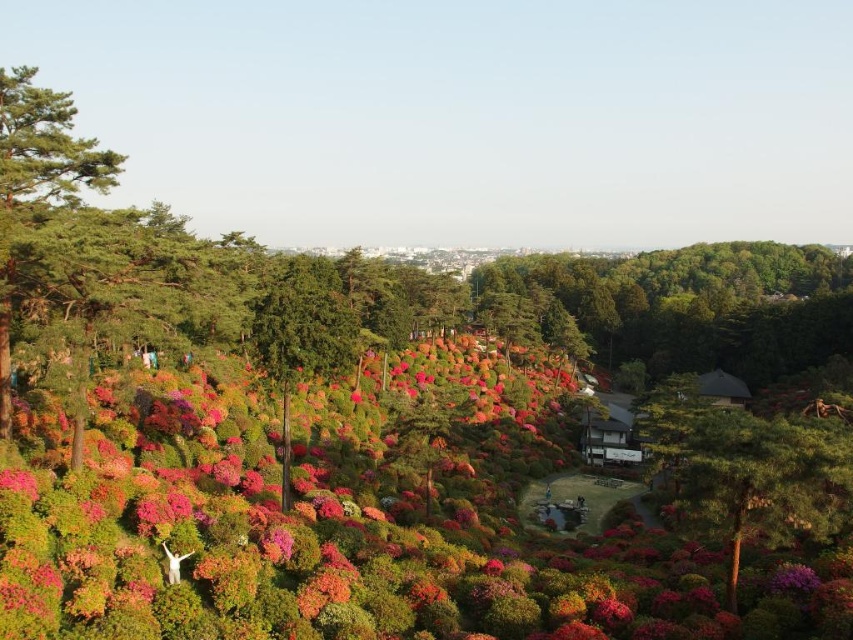
Question: Is green rough bark tree at left thinner than green matte tree at center?

Choices:
 (A) yes
 (B) no

Answer: (A)

Question: Which object is positioned closest to the green textured tree at center-right?

Choices:
 (A) green rough bark tree at left
 (B) green matte tree at center

Answer: (B)

Question: Does green textured tree at center-right appear on the right side of green matte tree at center?

Choices:
 (A) no
 (B) yes

Answer: (B)

Question: Among these points, which one is nearest to the camera?

Choices:
 (A) (0, 124)
 (B) (751, 518)

Answer: (B)

Question: Is green textured tree at center-right to the right of green matte tree at center from the viewer's perspective?

Choices:
 (A) yes
 (B) no

Answer: (A)

Question: Which point is farther to the camera?

Choices:
 (A) (740, 426)
 (B) (316, 369)

Answer: (B)